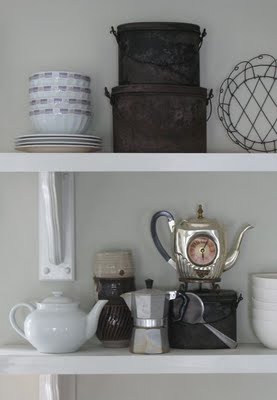
This screenshot has width=277, height=400. I want to click on left shelf brace, so click(49, 197), click(53, 391).